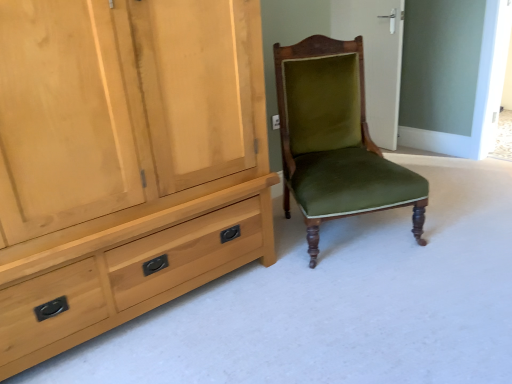
Identify the location of vacant area that lies between light wood cabinet at left and velvet green chair at center. (274, 288).